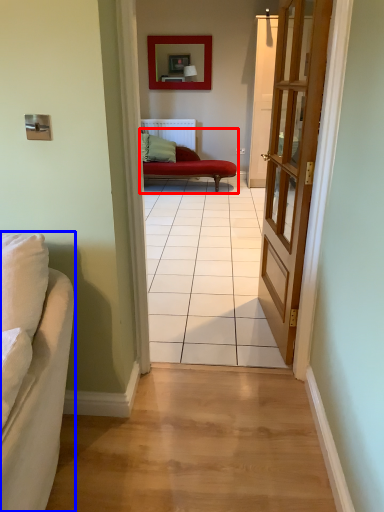
Question: Which object appears closest to the camera in this image, studio couch (highlighted by a red box) or studio couch (highlighted by a blue box)?

Choices:
 (A) studio couch
 (B) studio couch

Answer: (B)